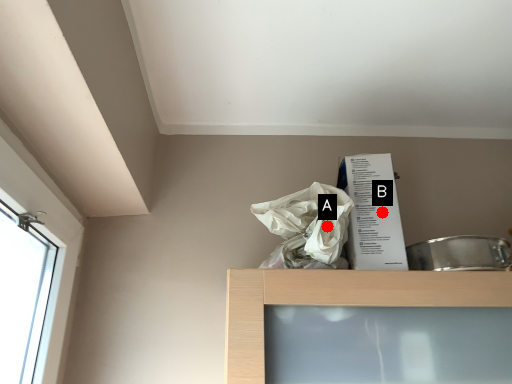
Question: Two points are circled on the image, labeled by A and B beside each circle. Which point is closer to the camera?

Choices:
 (A) A is closer
 (B) B is closer

Answer: (A)